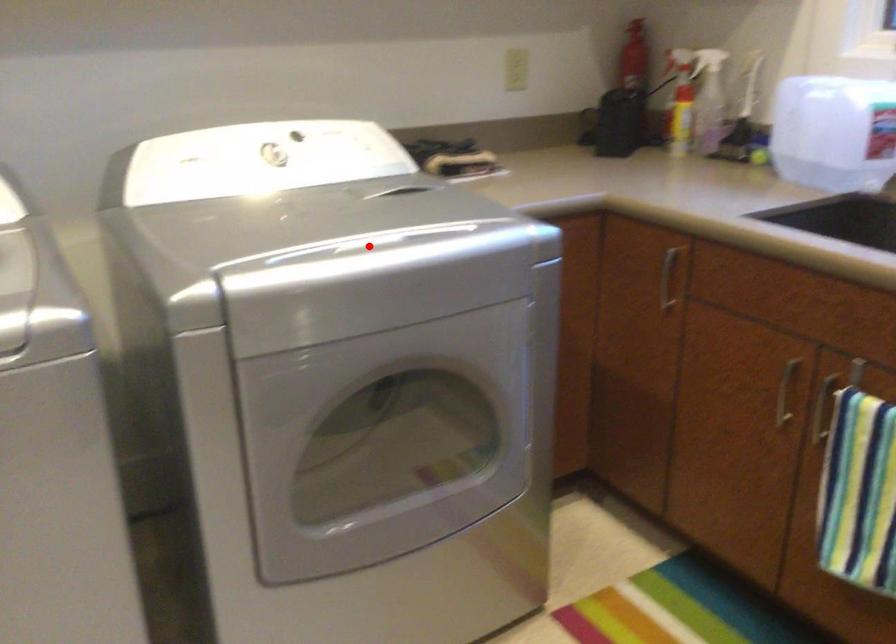
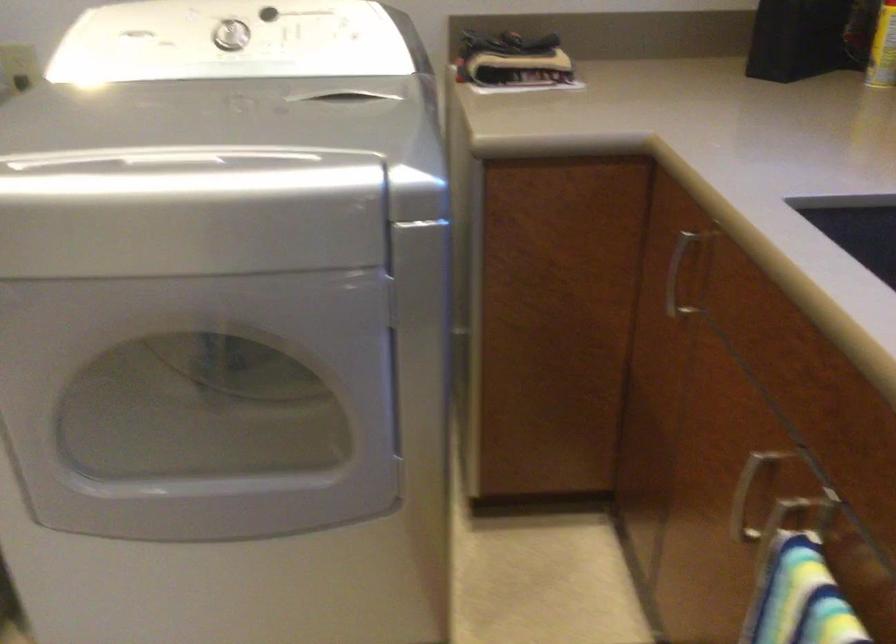
Where in the second image is the point corresponding to the highlighted location from the first image?

(178, 160)